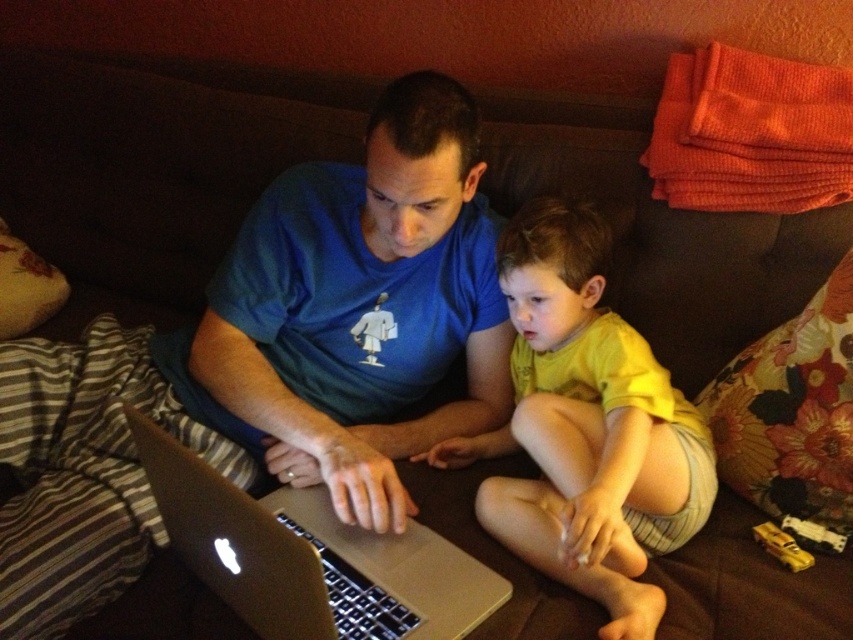
Question: Does yellow cotton shirt at center have a lesser width compared to silver metallic laptop at center?

Choices:
 (A) no
 (B) yes

Answer: (B)

Question: Is yellow cotton shirt at center positioned behind silver metallic laptop at center?

Choices:
 (A) yes
 (B) no

Answer: (A)

Question: Which object appears closest to the camera in this image?

Choices:
 (A) yellow cotton shirt at center
 (B) silver metallic laptop at center

Answer: (B)

Question: Is yellow cotton shirt at center to the left of silver metallic laptop at center from the viewer's perspective?

Choices:
 (A) no
 (B) yes

Answer: (A)